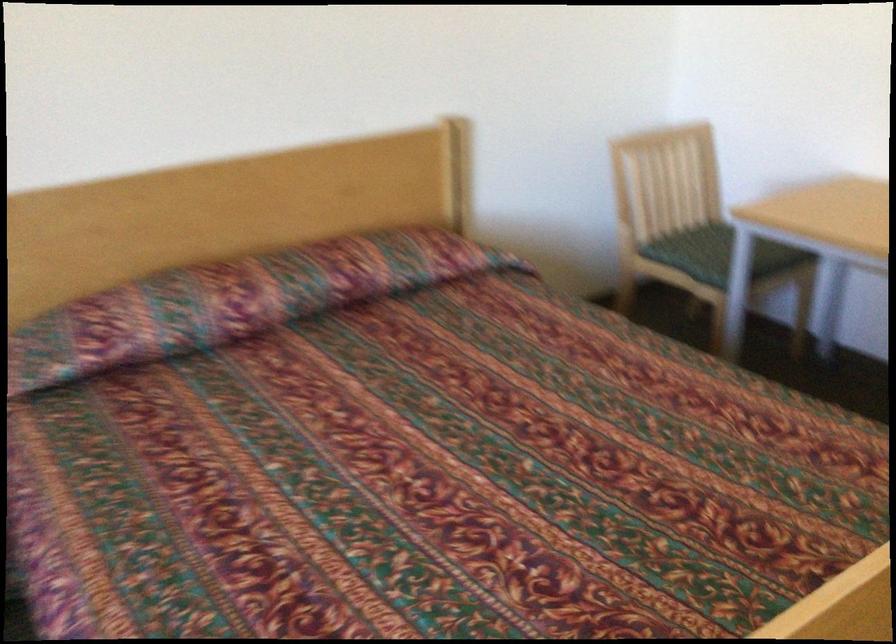
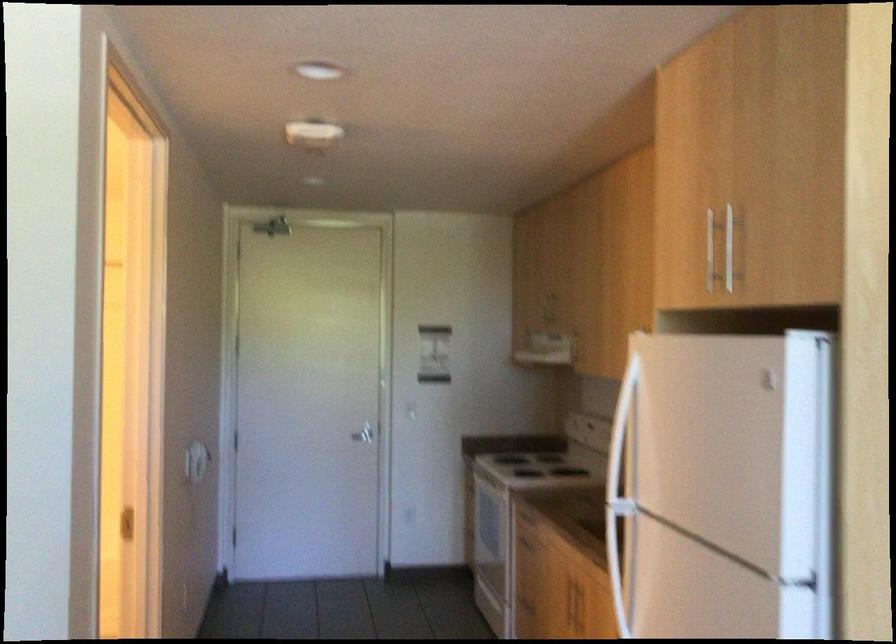
Question: Based on the continuous images, in which direction is the camera rotating? Reply with the corresponding letter.

Choices:
 (A) Left
 (B) Right
 (C) Up
 (D) Down

Answer: (B)